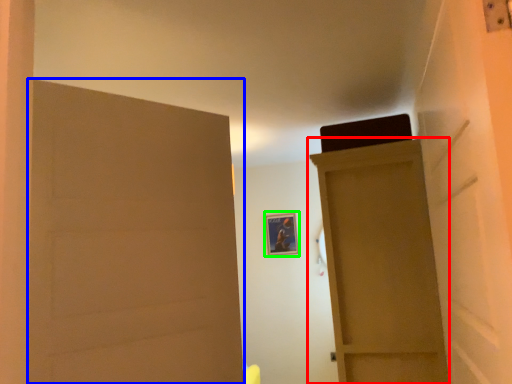
Question: Considering the real-world distances, which object is closest to door (highlighted by a red box)? door (highlighted by a blue box) or picture frame (highlighted by a green box).

Choices:
 (A) door
 (B) picture frame

Answer: (A)